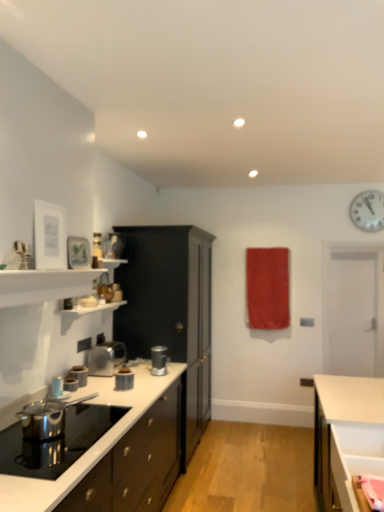
The height and width of the screenshot is (512, 384). Find the location of `metallic silver toaster at center, which ranks as the second kitchen appliance in right-to-left order`. metallic silver toaster at center, which ranks as the second kitchen appliance in right-to-left order is located at coordinates (124, 379).

Where is `metallic silver toaster at left, which is the 3th kitchen appliance in left-to-right order`? metallic silver toaster at left, which is the 3th kitchen appliance in left-to-right order is located at coordinates (79, 374).

Describe the element at coordinates (106, 358) in the screenshot. I see `satin silver kettle at center, acting as the 1th appliance starting from the back` at that location.

The width and height of the screenshot is (384, 512). I want to click on metallic silver kettle at left, the 5th kitchen appliance when ordered from back to front, so click(x=57, y=387).

From the image's perspective, is white metallic clock at upper right over metallic silver toaster at left, arranged as the second kitchen appliance when viewed from the left?

Indeed, from the image's perspective, white metallic clock at upper right is shown above metallic silver toaster at left, arranged as the second kitchen appliance when viewed from the left.

Based on their positions, is white metallic clock at upper right located to the left or right of metallic silver toaster at left, the 4th kitchen appliance viewed from the back?

In the image, white metallic clock at upper right appears on the right side of metallic silver toaster at left, the 4th kitchen appliance viewed from the back.

In order to click on clock above the metallic silver toaster at left, which is the fourth kitchen appliance in right-to-left order (from the image's perspective) in this screenshot , I will do `click(368, 211)`.

Is glossy dark wood cabinet at lower left, the first cabinetry from the front, positioned before metallic silver toaster at left, which is counted as the 3th kitchen appliance, starting from the right?

Yes, it is.

Is glossy dark wood cabinet at lower left, which appears as the 2th cabinetry when viewed from the back, bigger than metallic silver toaster at left, which is the 3th kitchen appliance in left-to-right order?

Indeed, glossy dark wood cabinet at lower left, which appears as the 2th cabinetry when viewed from the back, has a larger size compared to metallic silver toaster at left, which is the 3th kitchen appliance in left-to-right order.

Is glossy dark wood cabinet at lower left, which appears as the 2th cabinetry when viewed from the back, oriented away from metallic silver toaster at left, which is counted as the second kitchen appliance, starting from the back?

glossy dark wood cabinet at lower left, which appears as the 2th cabinetry when viewed from the back, does not have its back to metallic silver toaster at left, which is counted as the second kitchen appliance, starting from the back.

Who is taller, matte red curtain at center or satin silver blender at center, placed as the fifth kitchen appliance when sorted from front to back?

With more height is matte red curtain at center.

From the image's perspective, is matte red curtain at center located above satin silver blender at center, which is counted as the 1th kitchen appliance, starting from the back?

Yes, from the image's perspective, matte red curtain at center is above satin silver blender at center, which is counted as the 1th kitchen appliance, starting from the back.

Is matte red curtain at center smaller than satin silver blender at center, which ranks as the fifth kitchen appliance in left-to-right order?

No, matte red curtain at center is not smaller than satin silver blender at center, which ranks as the fifth kitchen appliance in left-to-right order.

This screenshot has width=384, height=512. I want to click on the 1st kitchen appliance counting from the left side of the matte red curtain at center, so click(159, 360).

Is point (73, 380) less distant than point (257, 274)?

Yes, it is in front of point (257, 274).

Find the location of a particular element. Image resolution: width=384 pixels, height=512 pixels. curtain behind the metallic silver toaster at left, the 4th kitchen appliance viewed from the back is located at coordinates (267, 288).

Are metallic silver toaster at left, placed as the second kitchen appliance when sorted from front to back, and matte red curtain at center making contact?

They are not placed beside each other.

From the image's perspective, is white glossy shelf at upper left on top of metallic silver toaster at center, which is the fourth kitchen appliance from left to right?

Yes, from the image's perspective, white glossy shelf at upper left is on top of metallic silver toaster at center, which is the fourth kitchen appliance from left to right.

Would you consider white glossy shelf at upper left to be distant from metallic silver toaster at center, which ranks as the second kitchen appliance in right-to-left order?

white glossy shelf at upper left is near metallic silver toaster at center, which ranks as the second kitchen appliance in right-to-left order, not far away.

The image size is (384, 512). Find the location of `the 3rd kitchen appliance behind the white glossy shelf at upper left, counting from the anchor's position`. the 3rd kitchen appliance behind the white glossy shelf at upper left, counting from the anchor's position is located at coordinates (124, 379).

What's the angular difference between white glossy shelf at upper left and metallic silver toaster at center, which is the fourth kitchen appliance from left to right,'s facing directions?

They differ by 0.575 degrees in their facing directions.

How many degrees apart are the facing directions of glossy dark wood cabinet at lower left, the first cabinetry from the front, and satin silver kettle at center, acting as the 1th appliance starting from the back?

1.27 degrees.

Does glossy dark wood cabinet at lower left, which appears as the 2th cabinetry when viewed from the back, lie in front of satin silver kettle at center, arranged as the second appliance when viewed from the front?

Yes, glossy dark wood cabinet at lower left, which appears as the 2th cabinetry when viewed from the back, is closer to the camera.

Considering the sizes of objects glossy dark wood cabinet at lower left, the first cabinetry from the front, and satin silver kettle at center, acting as the 1th appliance starting from the back, in the image provided, who is bigger, glossy dark wood cabinet at lower left, the first cabinetry from the front, or satin silver kettle at center, acting as the 1th appliance starting from the back,?

Bigger between the two is glossy dark wood cabinet at lower left, the first cabinetry from the front.

Are metallic silver toaster at left, which is the fourth kitchen appliance in right-to-left order, and metallic silver kettle at left, which appears as the 5th kitchen appliance when viewed from the right, making contact?

Yes, metallic silver toaster at left, which is the fourth kitchen appliance in right-to-left order, is touching metallic silver kettle at left, which appears as the 5th kitchen appliance when viewed from the right.

From a real-world perspective, which object stands above the other?

metallic silver kettle at left, the 1th kitchen appliance in the left-to-right sequence.

Would you say metallic silver kettle at left, positioned as the 1th kitchen appliance in front-to-back order, is part of metallic silver toaster at left, arranged as the second kitchen appliance when viewed from the left,'s contents?

No, metallic silver kettle at left, positioned as the 1th kitchen appliance in front-to-back order, is located outside of metallic silver toaster at left, arranged as the second kitchen appliance when viewed from the left.

Can you confirm if metallic silver toaster at left, placed as the second kitchen appliance when sorted from front to back, is bigger than metallic silver kettle at left, the 5th kitchen appliance when ordered from back to front?

Yes.

Where is `clock above the metallic silver toaster at left, which is the fourth kitchen appliance in right-to-left order (from the image's perspective)`? The height and width of the screenshot is (512, 384). clock above the metallic silver toaster at left, which is the fourth kitchen appliance in right-to-left order (from the image's perspective) is located at coordinates (368, 211).

Identify the location of the 2nd kitchen appliance located above the glossy dark wood cabinet at lower left, which appears as the 2th cabinetry when viewed from the back (from a real-world perspective). Image resolution: width=384 pixels, height=512 pixels. (79, 374).

When comparing their distances from white metallic clock at upper right, does metallic silver toaster at center, which ranks as the third kitchen appliance in back-to-front order, or metallic silver toaster at left, which is the 3th kitchen appliance in left-to-right order, seem further?

metallic silver toaster at left, which is the 3th kitchen appliance in left-to-right order.

When comparing their distances from glossy dark wood cabinet at lower left, the first cabinetry from the front, does metallic silver toaster at left, which is the fourth kitchen appliance in right-to-left order, or black matte cabinet at center, the 2th cabinetry in the front-to-back sequence, seem closer?

Based on the image, metallic silver toaster at left, which is the fourth kitchen appliance in right-to-left order, appears to be nearer to glossy dark wood cabinet at lower left, the first cabinetry from the front.

Considering their positions, is metallic silver toaster at left, which is counted as the 3th kitchen appliance, starting from the right, positioned closer to metallic silver kettle at left, positioned as the 1th kitchen appliance in front-to-back order, than white glossy shelf at upper left?

metallic silver toaster at left, which is counted as the 3th kitchen appliance, starting from the right, is closer to metallic silver kettle at left, positioned as the 1th kitchen appliance in front-to-back order.

Looking at this image, looking at the image, which one is located closer to metallic silver toaster at left, which is counted as the 3th kitchen appliance, starting from the right, satin silver blender at center, placed as the fifth kitchen appliance when sorted from front to back, or glossy dark wood cabinet at lower left, which appears as the 2th cabinetry when viewed from the back?

The object closer to metallic silver toaster at left, which is counted as the 3th kitchen appliance, starting from the right, is satin silver blender at center, placed as the fifth kitchen appliance when sorted from front to back.

When comparing their distances from satin silver kettle at center, acting as the 1th appliance starting from the back, does metallic silver toaster at left, the 4th kitchen appliance viewed from the back, or satin silver blender at center, acting as the first kitchen appliance starting from the right, seem closer?

metallic silver toaster at left, the 4th kitchen appliance viewed from the back, lies closer to satin silver kettle at center, acting as the 1th appliance starting from the back, than the other object.

Which object lies further to the anchor point black matte cabinet at center, the first cabinetry from the back, white glossy shelf at upper left or polished stainless steel kettle at lower left, which appears as the 2th appliance when viewed from the back?

white glossy shelf at upper left lies further to black matte cabinet at center, the first cabinetry from the back, than the other object.

When comparing their distances from glossy dark wood cabinet at lower left, which appears as the 2th cabinetry when viewed from the back, does white glossy shelf at upper left or satin silver blender at center, which ranks as the fifth kitchen appliance in left-to-right order, seem further?

Among the two, white glossy shelf at upper left is located further to glossy dark wood cabinet at lower left, which appears as the 2th cabinetry when viewed from the back.

When comparing their distances from metallic silver toaster at left, the 4th kitchen appliance viewed from the back, does satin silver kettle at center, arranged as the second appliance when viewed from the front, or white glossy shelf at upper left seem further?

white glossy shelf at upper left lies further to metallic silver toaster at left, the 4th kitchen appliance viewed from the back, than the other object.

Identify the location of appliance situated between satin silver kettle at center, acting as the 1th appliance starting from the back, and white metallic clock at upper right from left to right. The image size is (384, 512). (47, 417).

Locate an element on the screen. curtain between satin silver blender at center, acting as the first kitchen appliance starting from the right, and white metallic clock at upper right, in the horizontal direction is located at coordinates click(x=267, y=288).

Identify the location of kitchen appliance between metallic silver toaster at left, which is counted as the 3th kitchen appliance, starting from the right, and satin silver blender at center, placed as the fifth kitchen appliance when sorted from front to back, in the horizontal direction. The image size is (384, 512). (124, 379).

Image resolution: width=384 pixels, height=512 pixels. Identify the location of appliance located between metallic silver kettle at left, the 5th kitchen appliance when ordered from back to front, and matte red curtain at center in the depth direction. (106, 358).